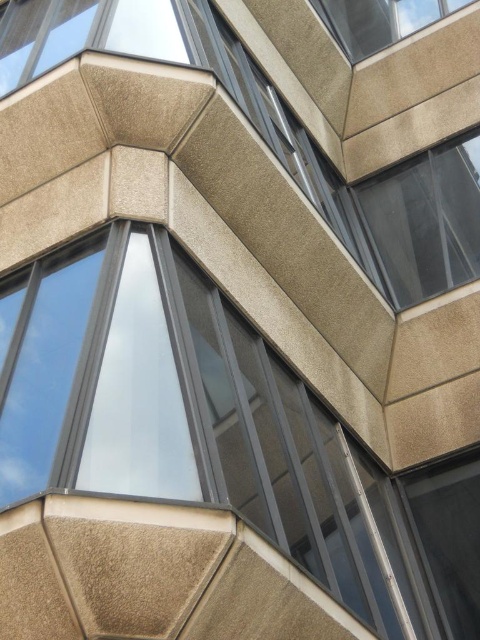
You are an architect analyzing the building facade. Which window, the clear glass window at center or the slate gray concrete window at upper right, is located higher up in the structure?

The slate gray concrete window at upper right is located higher up in the structure than the clear glass window at center, as it is positioned above it.

You are an architect analyzing the building facade. You notice the clear glass window at center and the slate gray concrete window at upper right. Which window has a greater width?

The clear glass window at center might be wider than the slate gray concrete window at upper right according to the description.